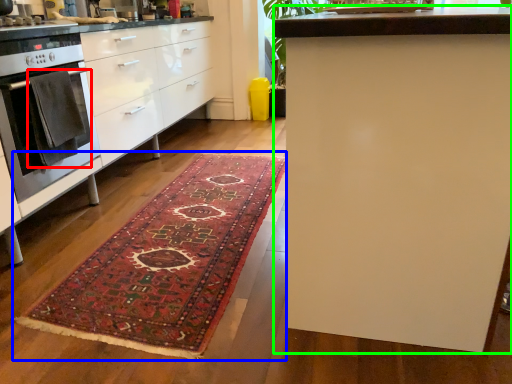
Question: Which object is the farthest from blanket (highlighted by a red box)? Choose among these: mat (highlighted by a blue box) or table (highlighted by a green box).

Choices:
 (A) mat
 (B) table

Answer: (B)